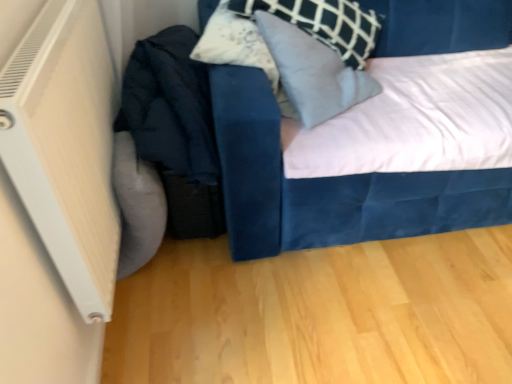
Question: Are velvet blue bed at center and velvet blue pillow at upper center beside each other?

Choices:
 (A) yes
 (B) no

Answer: (B)

Question: Is velvet blue bed at center thinner than velvet blue pillow at upper center?

Choices:
 (A) yes
 (B) no

Answer: (B)

Question: Is velvet blue bed at center in front of velvet blue pillow at upper center?

Choices:
 (A) yes
 (B) no

Answer: (A)

Question: Can you confirm if velvet blue bed at center is bigger than velvet blue pillow at upper center?

Choices:
 (A) yes
 (B) no

Answer: (A)

Question: Considering the relative sizes of velvet blue bed at center and velvet blue pillow at upper center in the image provided, is velvet blue bed at center wider than velvet blue pillow at upper center?

Choices:
 (A) yes
 (B) no

Answer: (A)

Question: Does point (307, 104) appear closer or farther from the camera than point (330, 201)?

Choices:
 (A) closer
 (B) farther

Answer: (A)

Question: In the image, is velvet blue pillow at upper center positioned in front of or behind velvet blue bed at center?

Choices:
 (A) behind
 (B) front

Answer: (A)

Question: In terms of width, does velvet blue pillow at upper center look wider or thinner when compared to velvet blue bed at center?

Choices:
 (A) thin
 (B) wide

Answer: (A)

Question: From a real-world perspective, relative to velvet blue bed at center, is velvet blue pillow at upper center vertically above or below?

Choices:
 (A) below
 (B) above

Answer: (B)

Question: Relative to white plastic radiator at left, is velvet blue bed at center in front or behind?

Choices:
 (A) behind
 (B) front

Answer: (A)

Question: Which is correct: velvet blue bed at center is inside white plastic radiator at left, or outside of it?

Choices:
 (A) inside
 (B) outside

Answer: (B)

Question: Is point (382, 36) positioned closer to the camera than point (92, 301)?

Choices:
 (A) closer
 (B) farther

Answer: (B)

Question: Considering the positions of velvet blue bed at center and white plastic radiator at left in the image, is velvet blue bed at center wider or thinner than white plastic radiator at left?

Choices:
 (A) wide
 (B) thin

Answer: (A)

Question: Considering the relative positions of white plastic radiator at left and velvet blue bed at center in the image provided, is white plastic radiator at left to the left or to the right of velvet blue bed at center?

Choices:
 (A) left
 (B) right

Answer: (A)

Question: Does point (71, 59) appear closer or farther from the camera than point (394, 3)?

Choices:
 (A) farther
 (B) closer

Answer: (B)